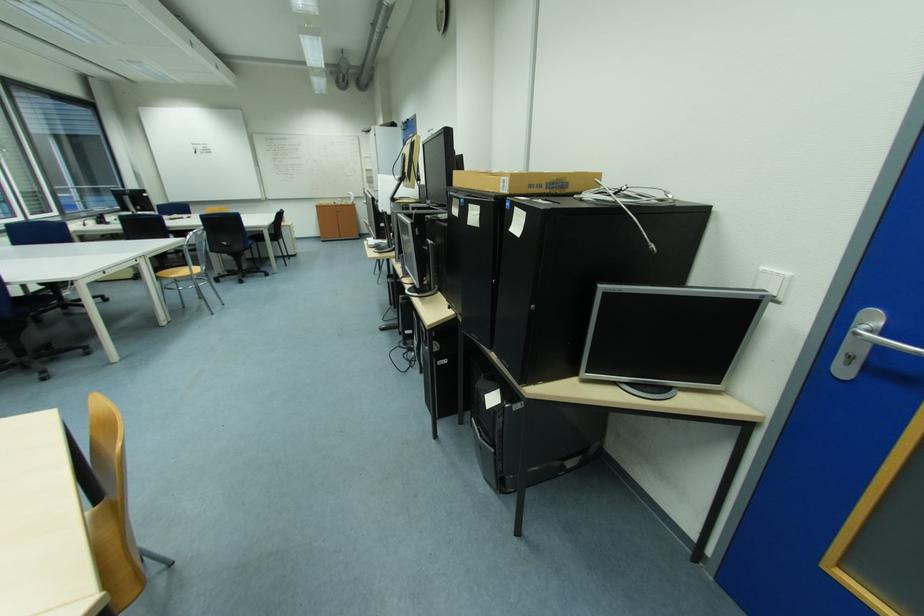
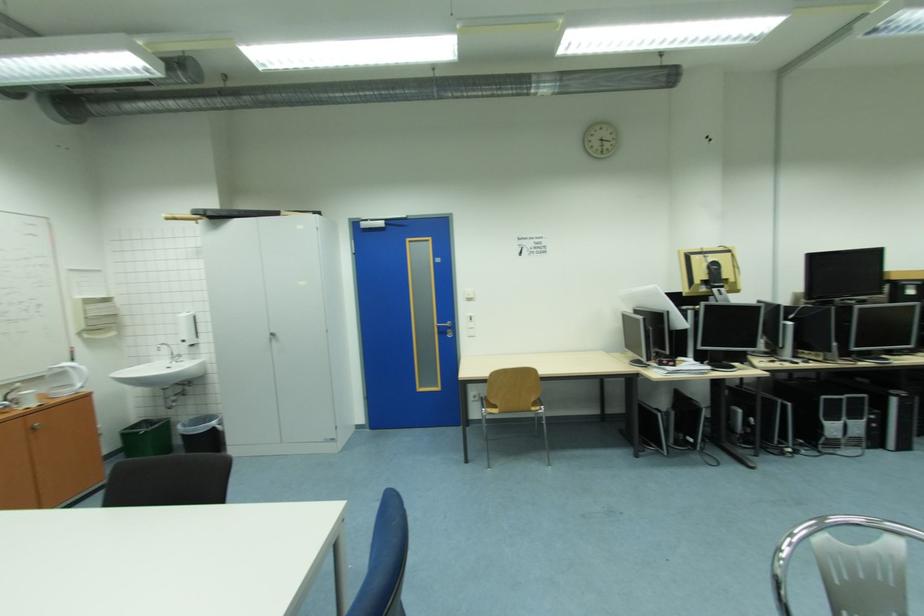
The point at (x=374, y=171) is marked in the first image. Where is the corresponding point in the second image?

(94, 302)